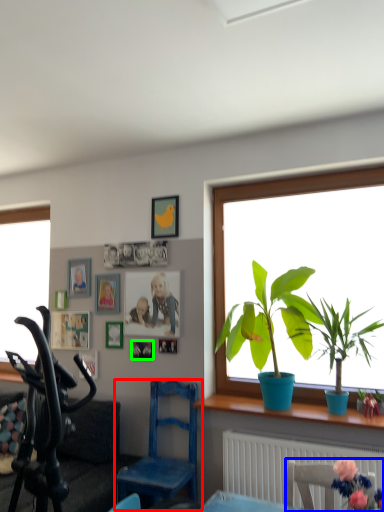
Question: Which is nearer to the chair (highlighted by a red box)? chair (highlighted by a blue box) or picture frame (highlighted by a green box).

Choices:
 (A) chair
 (B) picture frame

Answer: (B)